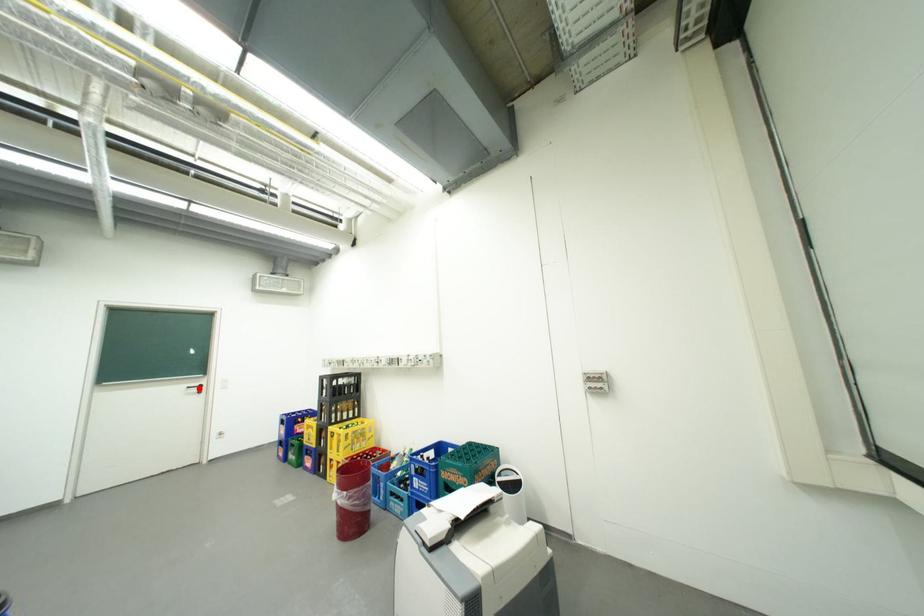
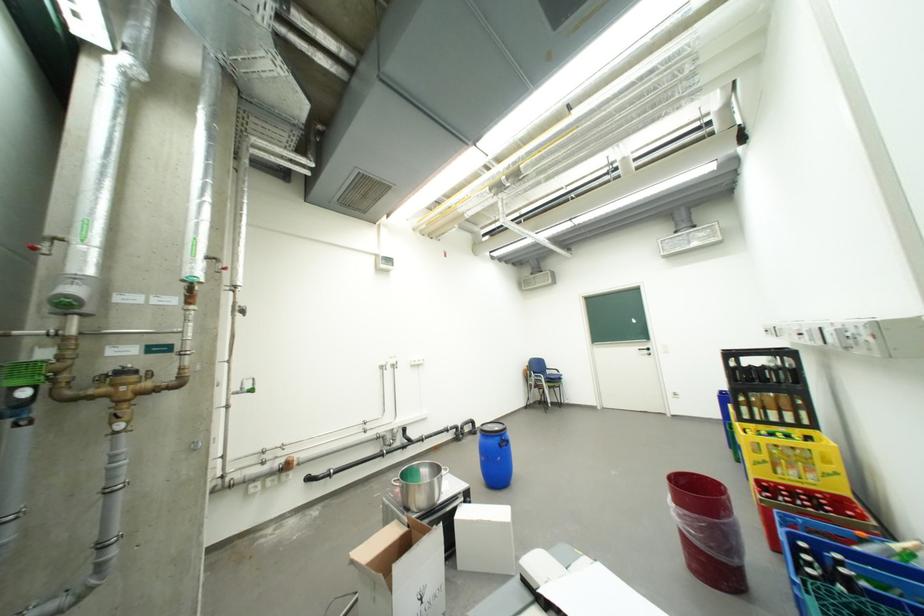
The point at the highlighted location is marked in the first image. Where is the corresponding point in the second image?

(650, 351)